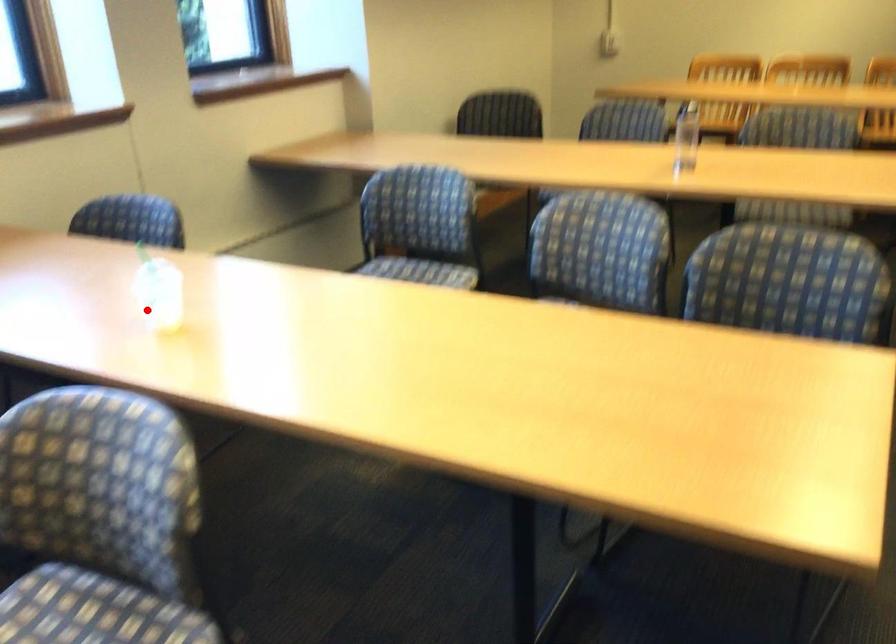
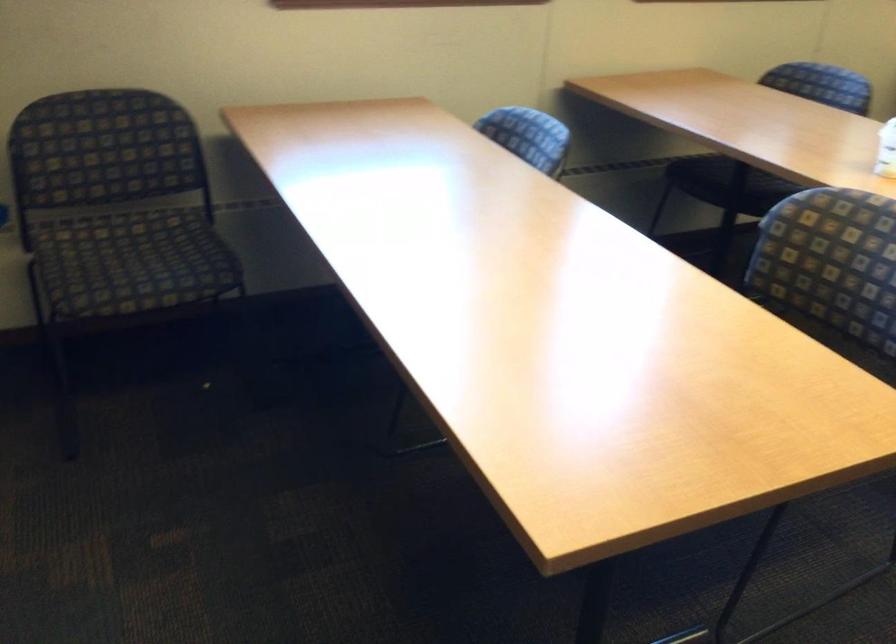
The point at the highlighted location is marked in the first image. Where is the corresponding point in the second image?

(885, 149)